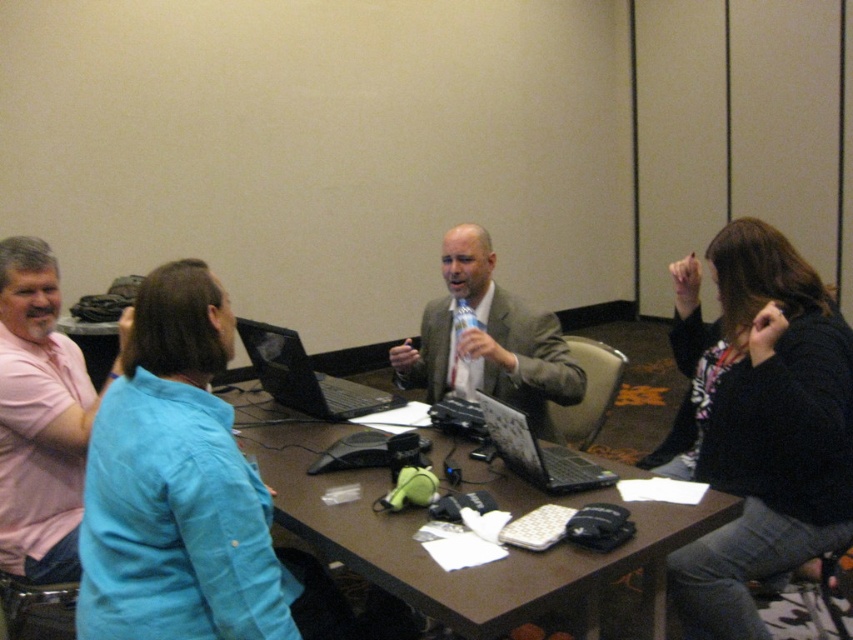
You are organizing a meeting in this conference room and notice the black sweater at right and the brown wooden table at center. Which object is on top of the other?

The black sweater at right is positioned over the brown wooden table at center, so the sweater is on top of the table.

You are organizing a meeting in a conference room and need to place a new laptop on the table. The laptop requires a space wider than the black sweater at right. Can the brown wooden table at center accommodate it?

The black sweater at right is narrower than the brown wooden table at center, so the table has enough width to accommodate the laptop requiring space wider than the sweater.